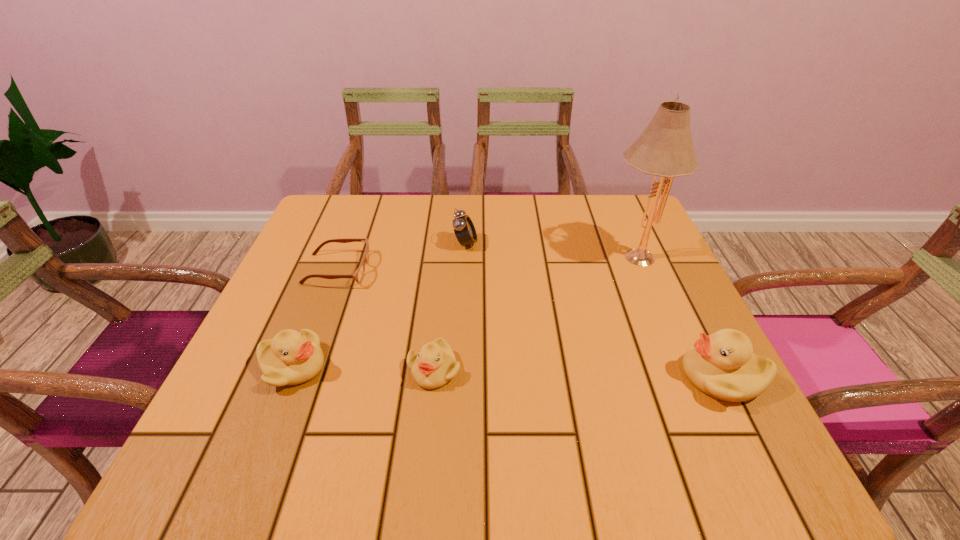
The width and height of the screenshot is (960, 540). I want to click on the leftmost duckling, so click(291, 358).

At what (x,y) coordinates should I click in order to perform the action: click on the fifth tallest object. Please return your answer as a coordinate pair (x, y). Looking at the image, I should click on (432, 367).

The width and height of the screenshot is (960, 540). I want to click on the second duckling from right to left, so click(x=432, y=367).

This screenshot has height=540, width=960. I want to click on the rightmost duckling, so click(x=722, y=365).

Find the location of a particular element. The image size is (960, 540). the shortest object is located at coordinates (358, 275).

At what (x,y) coordinates should I click in order to perform the action: click on lampshade. Please return your answer as a coordinate pair (x, y). Image resolution: width=960 pixels, height=540 pixels. Looking at the image, I should click on (665, 148).

Where is `alarm clock`? The image size is (960, 540). alarm clock is located at coordinates (464, 229).

The width and height of the screenshot is (960, 540). What are the coordinates of `vacant space positioned 0.220m at the face of the leftmost duckling` in the screenshot? It's located at (442, 366).

The width and height of the screenshot is (960, 540). What are the coordinates of `vacant point located 0.060m at the face of the fifth tallest object` in the screenshot? It's located at (429, 421).

Locate an element on the screen. vacant area situated 0.130m at the face of the rightmost duckling is located at coordinates (612, 376).